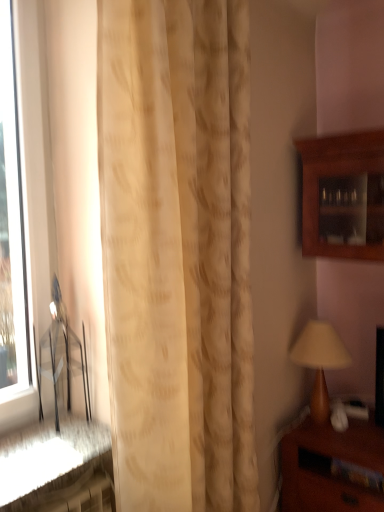
Question: From the image's perspective, would you say brown wooden nightstand at lower right is shown under transparent glass window at left?

Choices:
 (A) no
 (B) yes

Answer: (B)

Question: Can you confirm if brown wooden nightstand at lower right is smaller than transparent glass window at left?

Choices:
 (A) yes
 (B) no

Answer: (B)

Question: Could you tell me if brown wooden nightstand at lower right is turned towards transparent glass window at left?

Choices:
 (A) no
 (B) yes

Answer: (A)

Question: From a real-world perspective, is brown wooden nightstand at lower right under transparent glass window at left?

Choices:
 (A) no
 (B) yes

Answer: (B)

Question: Does brown wooden nightstand at lower right have a greater height compared to transparent glass window at left?

Choices:
 (A) yes
 (B) no

Answer: (B)

Question: Can you confirm if brown wooden nightstand at lower right is thinner than transparent glass window at left?

Choices:
 (A) no
 (B) yes

Answer: (A)

Question: Is matte brown table lamp at right completely or partially inside beige textured curtain at center?

Choices:
 (A) yes
 (B) no

Answer: (B)

Question: Is beige textured curtain at center at the left side of matte brown table lamp at right?

Choices:
 (A) no
 (B) yes

Answer: (B)

Question: Does beige textured curtain at center have a greater width compared to matte brown table lamp at right?

Choices:
 (A) no
 (B) yes

Answer: (A)

Question: Is beige textured curtain at center far from matte brown table lamp at right?

Choices:
 (A) no
 (B) yes

Answer: (B)

Question: Is beige textured curtain at center facing towards matte brown table lamp at right?

Choices:
 (A) yes
 (B) no

Answer: (B)

Question: Does beige textured curtain at center appear on the right side of matte brown table lamp at right?

Choices:
 (A) yes
 (B) no

Answer: (B)

Question: Is transparent glass window at left smaller than beige textured curtain at center?

Choices:
 (A) yes
 (B) no

Answer: (A)